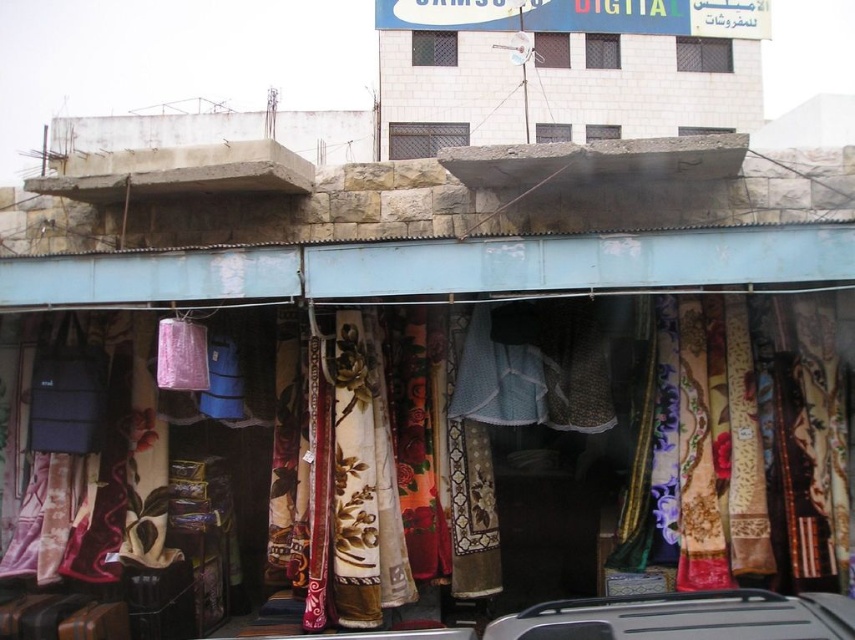
Question: Which point is farther to the camera?

Choices:
 (A) floral fabric at center
 (B) silver metallic car at lower center

Answer: (A)

Question: Among these points, which one is farthest from the camera?

Choices:
 (A) (799, 401)
 (B) (800, 616)

Answer: (A)

Question: Observing the image, what is the correct spatial positioning of floral fabric at center in reference to silver metallic car at lower center?

Choices:
 (A) below
 (B) above

Answer: (B)

Question: Does floral fabric at center appear under silver metallic car at lower center?

Choices:
 (A) no
 (B) yes

Answer: (A)

Question: Does floral fabric at center have a smaller size compared to silver metallic car at lower center?

Choices:
 (A) yes
 (B) no

Answer: (B)

Question: Which point appears closest to the camera in this image?

Choices:
 (A) (824, 634)
 (B) (697, 314)

Answer: (A)